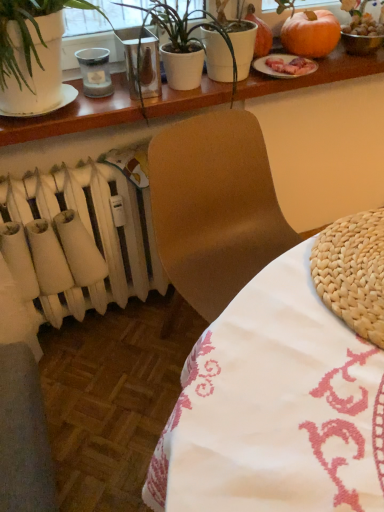
What do you see at coordinates (75, 116) in the screenshot? This screenshot has width=384, height=512. I see `white glossy table at upper center, the 2th table positioned from the bottom` at bounding box center [75, 116].

I want to click on orange matte pumpkin at upper right, so click(311, 33).

The height and width of the screenshot is (512, 384). What do you see at coordinates (285, 389) in the screenshot?
I see `white woven placemat at lower left, arranged as the second table when viewed from the top` at bounding box center [285, 389].

Locate an element on the screen. The width and height of the screenshot is (384, 512). metallic glass vase at upper center is located at coordinates (140, 61).

Is white ceramic plate at upper right at the right side of white glossy table at upper center, the 2th table positioned from the bottom?

Correct, you'll find white ceramic plate at upper right to the right of white glossy table at upper center, the 2th table positioned from the bottom.

Is white glossy table at upper center, the 2th table positioned from the bottom, at the back of white ceramic plate at upper right?

No, white ceramic plate at upper right is not facing away from white glossy table at upper center, the 2th table positioned from the bottom.

Do you think white ceramic plate at upper right is within white glossy table at upper center, which ranks as the first table in top-to-bottom order, or outside of it?

white ceramic plate at upper right is outside white glossy table at upper center, which ranks as the first table in top-to-bottom order.

Does white glossy table at upper center, which ranks as the first table in top-to-bottom order, have a greater width compared to white matte radiator at lower left?

Correct, the width of white glossy table at upper center, which ranks as the first table in top-to-bottom order, exceeds that of white matte radiator at lower left.

Which point is more distant from viewer, (310, 78) or (97, 218)?

Point (97, 218)

Which object is further away from the camera taking this photo, white glossy table at upper center, which ranks as the first table in top-to-bottom order, or white matte radiator at lower left?

white matte radiator at lower left is further from the camera.

Is point (176, 26) positioned before point (295, 59)?

Yes, point (176, 26) is in front of point (295, 59).

From a real-world perspective, is white matte pot at upper center physically located above or below white ceramic plate at upper right?

In terms of real-world spatial position, white matte pot at upper center is above white ceramic plate at upper right.

Which of these two, white matte pot at upper center or white ceramic plate at upper right, is wider?

white matte pot at upper center.

From a real-world perspective, who is located higher, orange matte pumpkin at upper right or white ceramic plate at upper right?

orange matte pumpkin at upper right, from a real-world perspective.

Between orange matte pumpkin at upper right and white ceramic plate at upper right, which one has less height?

white ceramic plate at upper right.

Between point (312, 27) and point (254, 66), which one is positioned behind?

The point (254, 66) is more distant.

Considering the points (127, 6) and (304, 44), which point is in front, point (127, 6) or point (304, 44)?

Positioned in front is point (127, 6).

I want to click on houseplant lying on the left of orange matte pumpkin at upper right, so click(x=184, y=29).

Could you tell me if white matte pot at upper center is facing orange matte pumpkin at upper right?

No, white matte pot at upper center is not facing towards orange matte pumpkin at upper right.

Is white matte pot at upper center in contact with orange matte pumpkin at upper right?

No, white matte pot at upper center is not beside orange matte pumpkin at upper right.

From the image's perspective, is white ceramic plate at upper right on white matte pot at upper center?

Yes.

Which is further, (291,76) or (234,76)?

The point (291,76) is farther.

Who is smaller, white ceramic plate at upper right or white matte pot at upper center?

With smaller size is white ceramic plate at upper right.

From a real-world perspective, is white ceramic plate at upper right on top of white matte pot at upper center?

No, from a real-world perspective, white ceramic plate at upper right is not above white matte pot at upper center.

Is white matte radiator at lower left positioned before white woven placemat at lower left, which ranks as the 1th table in bottom-to-top order?

No, it is behind white woven placemat at lower left, which ranks as the 1th table in bottom-to-top order.

Between white matte radiator at lower left and white woven placemat at lower left, which ranks as the 1th table in bottom-to-top order, which one appears on the right side from the viewer's perspective?

Positioned to the right is white woven placemat at lower left, which ranks as the 1th table in bottom-to-top order.

From a real-world perspective, is white matte radiator at lower left over white woven placemat at lower left, which ranks as the 1th table in bottom-to-top order?

No, from a real-world perspective, white matte radiator at lower left is not above white woven placemat at lower left, which ranks as the 1th table in bottom-to-top order.

I want to click on the 1st table below the white ceramic plate at upper right (from the image's perspective), so click(x=75, y=116).

Image resolution: width=384 pixels, height=512 pixels. What are the coordinates of `the 1st table in front of the white matte radiator at lower left, starting your count from the anchor` in the screenshot? It's located at (75, 116).

From the image, which object appears to be farther from white glossy table at upper center, the 2th table positioned from the bottom, metallic glass vase at upper center or white ceramic plate at upper right?

Among the two, white ceramic plate at upper right is located further to white glossy table at upper center, the 2th table positioned from the bottom.

Looking at the image, which one is located further to metallic glass vase at upper center, white ceramic plate at upper right or white glossy table at upper center, which ranks as the first table in top-to-bottom order?

white ceramic plate at upper right is positioned further to the anchor metallic glass vase at upper center.

Estimate the real-world distances between objects in this image. Which object is closer to white matte pot at upper center, white matte radiator at lower left or orange matte pumpkin at upper right?

orange matte pumpkin at upper right.

Which object lies further to the anchor point white matte pot at upper center, white glossy table at upper center, the 2th table positioned from the bottom, or metallic glass vase at upper center?

white glossy table at upper center, the 2th table positioned from the bottom, lies further to white matte pot at upper center than the other object.

Estimate the real-world distances between objects in this image. Which object is closer to orange matte pumpkin at upper right, white matte pot at upper center or white glossy table at upper center, the 2th table positioned from the bottom?

Among the two, white glossy table at upper center, the 2th table positioned from the bottom, is located nearer to orange matte pumpkin at upper right.

Based on their spatial positions, is white glossy table at upper center, the 2th table positioned from the bottom, or white matte radiator at lower left further from white matte pot at upper center?

The object further to white matte pot at upper center is white matte radiator at lower left.

From the image, which object appears to be farther from white ceramic plate at upper right, orange matte pumpkin at upper right or white glossy table at upper center, which ranks as the first table in top-to-bottom order?

white glossy table at upper center, which ranks as the first table in top-to-bottom order.

When comparing their distances from white ceramic plate at upper right, does white woven placemat at lower left, arranged as the second table when viewed from the top, or orange matte pumpkin at upper right seem further?

Among the two, white woven placemat at lower left, arranged as the second table when viewed from the top, is located further to white ceramic plate at upper right.

Where is `glass vase between white glossy table at upper center, which ranks as the first table in top-to-bottom order, and white matte radiator at lower left in the up-down direction`? glass vase between white glossy table at upper center, which ranks as the first table in top-to-bottom order, and white matte radiator at lower left in the up-down direction is located at coordinates (140, 61).

Image resolution: width=384 pixels, height=512 pixels. What are the coordinates of `glass vase between white matte pot at upper center and white matte radiator at lower left in the up-down direction` in the screenshot? It's located at (140, 61).

The image size is (384, 512). I want to click on houseplant between metallic glass vase at upper center and white glossy table at upper center, the 2th table positioned from the bottom, so click(184, 29).

Find the location of a particular element. The width and height of the screenshot is (384, 512). glass vase between white ceramic plate at upper right and white woven placemat at lower left, which ranks as the 1th table in bottom-to-top order, in the vertical direction is located at coordinates (140, 61).